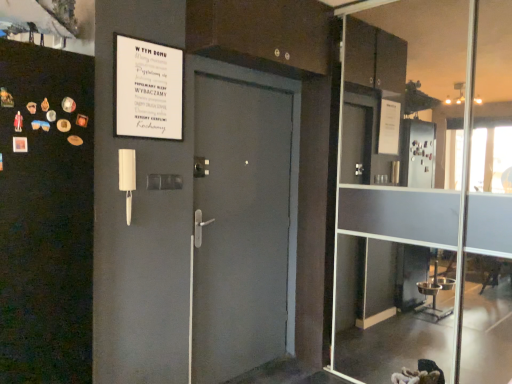
What do you see at coordinates (426, 194) in the screenshot? The width and height of the screenshot is (512, 384). I see `transparent glass door at center` at bounding box center [426, 194].

Identify the location of transparent glass door at center. This screenshot has height=384, width=512. (426, 194).

Describe the element at coordinates (147, 89) in the screenshot. I see `white paper sign at upper left` at that location.

Where is `white paper sign at upper left`? This screenshot has height=384, width=512. white paper sign at upper left is located at coordinates (147, 89).

Measure the distance between point (148, 115) and camera.

Point (148, 115) is 2.29 meters from camera.

I want to click on transparent glass door at center, so click(426, 194).

Which object is positioned more to the left, white paper sign at upper left or transparent glass door at center?

Positioned to the left is white paper sign at upper left.

Between white paper sign at upper left and transparent glass door at center, which one is positioned behind?

white paper sign at upper left.

Considering the points (172, 101) and (447, 6), which point is behind, point (172, 101) or point (447, 6)?

Positioned behind is point (447, 6).

From the image's perspective, which one is positioned higher, white paper sign at upper left or transparent glass door at center?

white paper sign at upper left.

From a real-world perspective, which is physically above, white paper sign at upper left or transparent glass door at center?

white paper sign at upper left.

Based on the photo, considering the sizes of objects white paper sign at upper left and transparent glass door at center in the image provided, who is thinner, white paper sign at upper left or transparent glass door at center?

white paper sign at upper left.

Does white paper sign at upper left have a greater height compared to transparent glass door at center?

No.

In terms of size, does white paper sign at upper left appear bigger or smaller than transparent glass door at center?

In the image, white paper sign at upper left appears to be smaller than transparent glass door at center.

Can we say white paper sign at upper left lies outside transparent glass door at center?

Absolutely, white paper sign at upper left is external to transparent glass door at center.

Can you see white paper sign at upper left touching transparent glass door at center?

No, white paper sign at upper left is not in contact with transparent glass door at center.

Is white paper sign at upper left oriented away from transparent glass door at center?

That's not correct — white paper sign at upper left is not looking away from transparent glass door at center.

Where is `glass door below the white paper sign at upper left (from a real-world perspective)`? The width and height of the screenshot is (512, 384). glass door below the white paper sign at upper left (from a real-world perspective) is located at coordinates (426, 194).

Is transparent glass door at center at the right side of white paper sign at upper left?

Yes, transparent glass door at center is to the right of white paper sign at upper left.

Relative to white paper sign at upper left, is transparent glass door at center in front or behind?

Visually, transparent glass door at center is located in front of white paper sign at upper left.

Between point (418, 162) and point (139, 74), which one is positioned behind?

Point (418, 162)

From the image's perspective, relative to white paper sign at upper left, is transparent glass door at center above or below?

From the image's perspective, transparent glass door at center appears below white paper sign at upper left.

From a real-world perspective, who is located lower, transparent glass door at center or white paper sign at upper left?

transparent glass door at center is physically lower.

Considering the sizes of transparent glass door at center and white paper sign at upper left in the image, is transparent glass door at center wider or thinner than white paper sign at upper left?

transparent glass door at center is wider than white paper sign at upper left.

Considering the sizes of transparent glass door at center and white paper sign at upper left in the image, is transparent glass door at center taller or shorter than white paper sign at upper left?

Considering their sizes, transparent glass door at center has more height than white paper sign at upper left.

Can you confirm if transparent glass door at center is bigger than white paper sign at upper left?

Yes, transparent glass door at center is bigger than white paper sign at upper left.

Is transparent glass door at center situated inside white paper sign at upper left or outside?

transparent glass door at center is located beyond the bounds of white paper sign at upper left.

Is transparent glass door at center far away from white paper sign at upper left?

transparent glass door at center is far away from white paper sign at upper left.

Could you tell me if transparent glass door at center is turned towards white paper sign at upper left?

Yes, transparent glass door at center faces towards white paper sign at upper left.

How different are the orientations of transparent glass door at center and white paper sign at upper left in degrees?

89 degrees.

In order to click on poster above the transparent glass door at center (from a real-world perspective) in this screenshot , I will do `click(147, 89)`.

At what (x,y) coordinates should I click in order to perform the action: click on poster above the transparent glass door at center (from a real-world perspective). Please return your answer as a coordinate pair (x, y). This screenshot has height=384, width=512. Looking at the image, I should click on (147, 89).

I want to click on poster lying on the left of transparent glass door at center, so click(x=147, y=89).